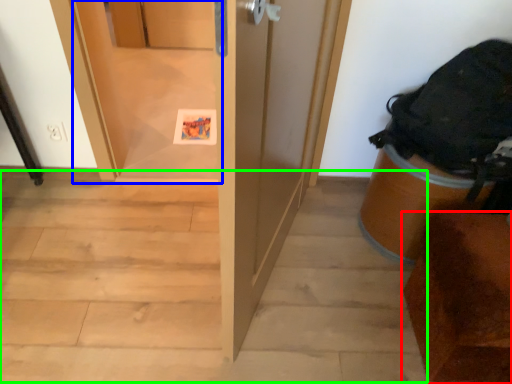
Question: Estimate the real-world distances between objects in this image. Which object is farther from furniture (highlighted by a red box), screen door (highlighted by a blue box) or stairwell (highlighted by a green box)?

Choices:
 (A) screen door
 (B) stairwell

Answer: (A)